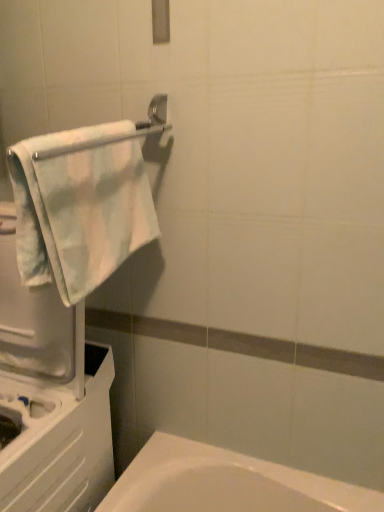
Find the location of a particular element. silver metallic towel bar at upper left is located at coordinates (117, 133).

Image resolution: width=384 pixels, height=512 pixels. Describe the element at coordinates (117, 133) in the screenshot. I see `silver metallic towel bar at upper left` at that location.

This screenshot has height=512, width=384. Describe the element at coordinates (80, 208) in the screenshot. I see `light blue plush towel at left` at that location.

I want to click on light blue plush towel at left, so click(x=80, y=208).

Where is `silver metallic towel bar at upper left`? Image resolution: width=384 pixels, height=512 pixels. silver metallic towel bar at upper left is located at coordinates pos(117,133).

Is silver metallic towel bar at upper left to the left or to the right of light blue plush towel at left in the image?

In the image, silver metallic towel bar at upper left appears on the right side of light blue plush towel at left.

Which object is closer to the camera taking this photo, silver metallic towel bar at upper left or light blue plush towel at left?

silver metallic towel bar at upper left is more forward.

Considering the positions of points (55, 152) and (112, 212), is point (55, 152) closer to camera compared to point (112, 212)?

Yes, it is.

From the image's perspective, between silver metallic towel bar at upper left and light blue plush towel at left, which one is located above?

silver metallic towel bar at upper left.

From a real-world perspective, which object stands above the other?

silver metallic towel bar at upper left is physically above.

In terms of width, does silver metallic towel bar at upper left look wider or thinner when compared to light blue plush towel at left?

silver metallic towel bar at upper left is thinner than light blue plush towel at left.

Is silver metallic towel bar at upper left taller or shorter than light blue plush towel at left?

Clearly, silver metallic towel bar at upper left is shorter compared to light blue plush towel at left.

Which of these two, silver metallic towel bar at upper left or light blue plush towel at left, is bigger?

With larger size is light blue plush towel at left.

Would you say silver metallic towel bar at upper left contains light blue plush towel at left?

No, light blue plush towel at left is not inside silver metallic towel bar at upper left.

Looking at this image, is there a large distance between silver metallic towel bar at upper left and light blue plush towel at left?

No, there isn't a large distance between silver metallic towel bar at upper left and light blue plush towel at left.

Could you tell me if silver metallic towel bar at upper left is facing light blue plush towel at left?

No, silver metallic towel bar at upper left does not turn towards light blue plush towel at left.

What are the coordinates of `towel on the left of silver metallic towel bar at upper left` in the screenshot? It's located at (80, 208).

Considering the positions of objects light blue plush towel at left and silver metallic towel bar at upper left in the image provided, who is more to the left, light blue plush towel at left or silver metallic towel bar at upper left?

light blue plush towel at left is more to the left.

Is the depth of light blue plush towel at left less than that of silver metallic towel bar at upper left?

No, light blue plush towel at left is further to the viewer.

Which point is more distant from viewer, [50,277] or [164,116]?

Point [164,116]

From the image's perspective, is light blue plush towel at left above or below silver metallic towel bar at upper left?

Based on their image positions, light blue plush towel at left is located beneath silver metallic towel bar at upper left.

From a real-world perspective, is light blue plush towel at left below silver metallic towel bar at upper left?

Yes.

Can you confirm if light blue plush towel at left is thinner than silver metallic towel bar at upper left?

No.

In the scene shown: Is light blue plush towel at left shorter than silver metallic towel bar at upper left?

No, light blue plush towel at left is not shorter than silver metallic towel bar at upper left.

Is light blue plush towel at left bigger or smaller than silver metallic towel bar at upper left?

Considering their sizes, light blue plush towel at left takes up more space than silver metallic towel bar at upper left.

Can we say light blue plush towel at left lies outside silver metallic towel bar at upper left?

Yes, light blue plush towel at left is located beyond the bounds of silver metallic towel bar at upper left.

Is light blue plush towel at left next to silver metallic towel bar at upper left?

light blue plush towel at left and silver metallic towel bar at upper left are clearly separated.

Is light blue plush towel at left aimed at silver metallic towel bar at upper left?

No, light blue plush towel at left is not aimed at silver metallic towel bar at upper left.

Measure the distance from light blue plush towel at left to silver metallic towel bar at upper left.

light blue plush towel at left is 4.83 inches away from silver metallic towel bar at upper left.

Locate an element on the screen. The width and height of the screenshot is (384, 512). towel bar lying above the light blue plush towel at left (from the image's perspective) is located at coordinates (117, 133).

Image resolution: width=384 pixels, height=512 pixels. Identify the location of towel that appears on the left of silver metallic towel bar at upper left. (80, 208).

You are a GUI agent. You are given a task and a screenshot of the screen. Output one action in this format:
    pyautogui.click(x=<x>, y=<y>)
    Task: Click on the towel bar above the light blue plush towel at left (from the image's perspective)
    This screenshot has height=512, width=384.
    Given the screenshot: What is the action you would take?
    pyautogui.click(x=117, y=133)